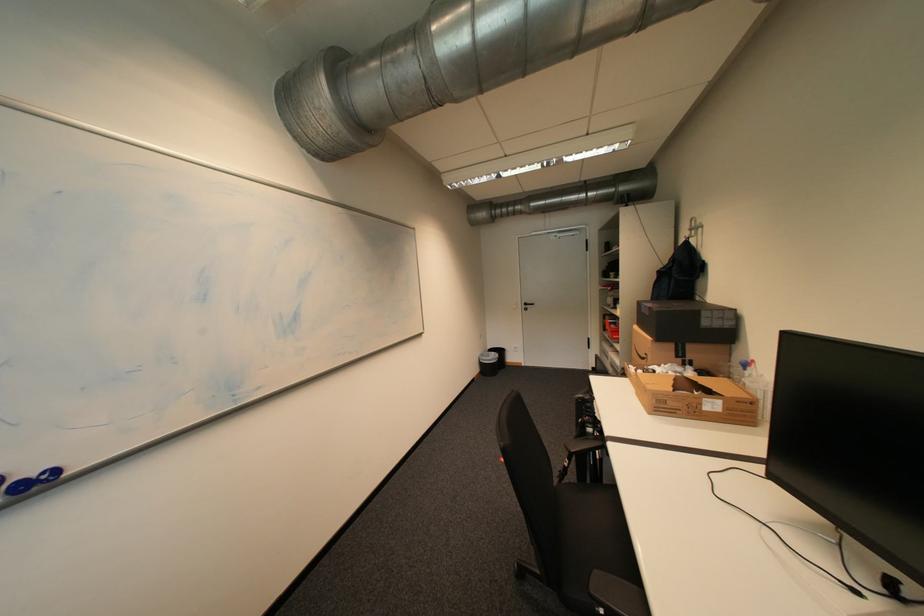
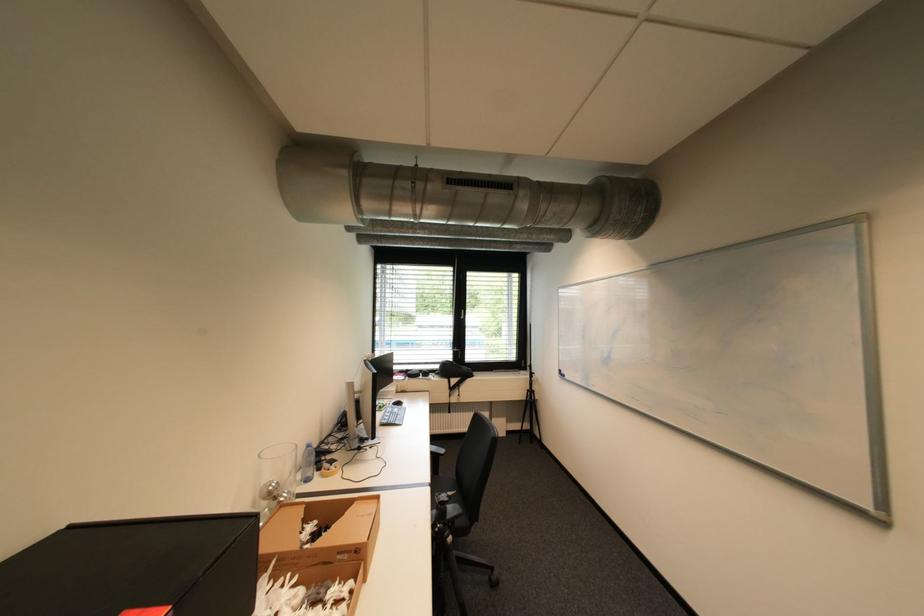
Locate, in the second image, the point that corresponds to [720,391] in the first image.

(311, 520)